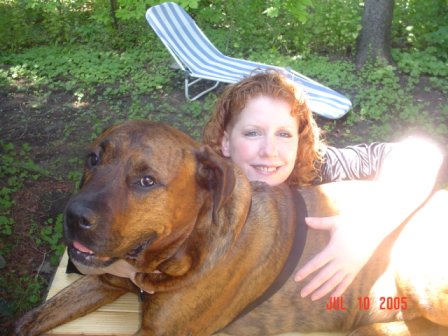
Locate an element on the screen. The image size is (448, 336). lounge chair is located at coordinates (203, 58).